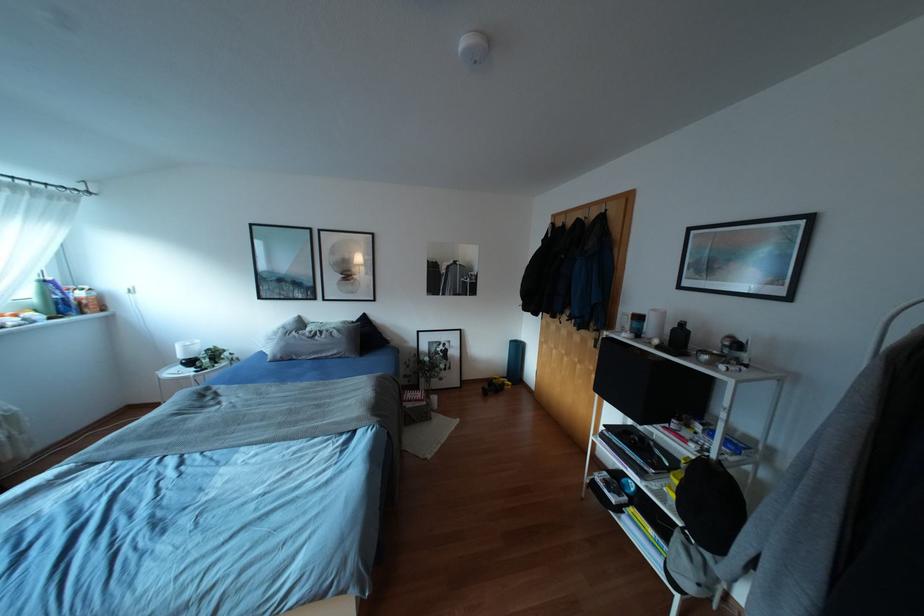
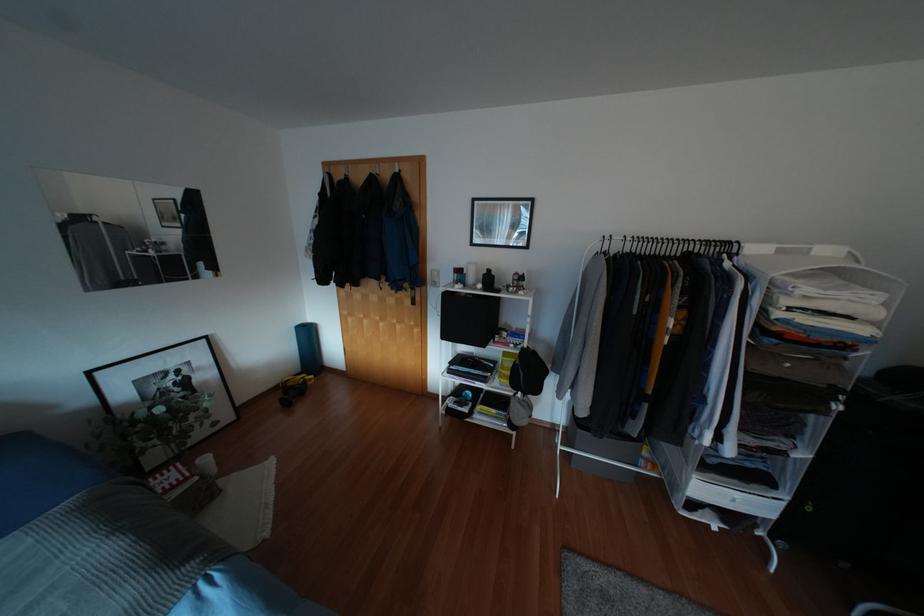
Find the pixel in the second image that matches [433,398] in the first image.

(205, 459)